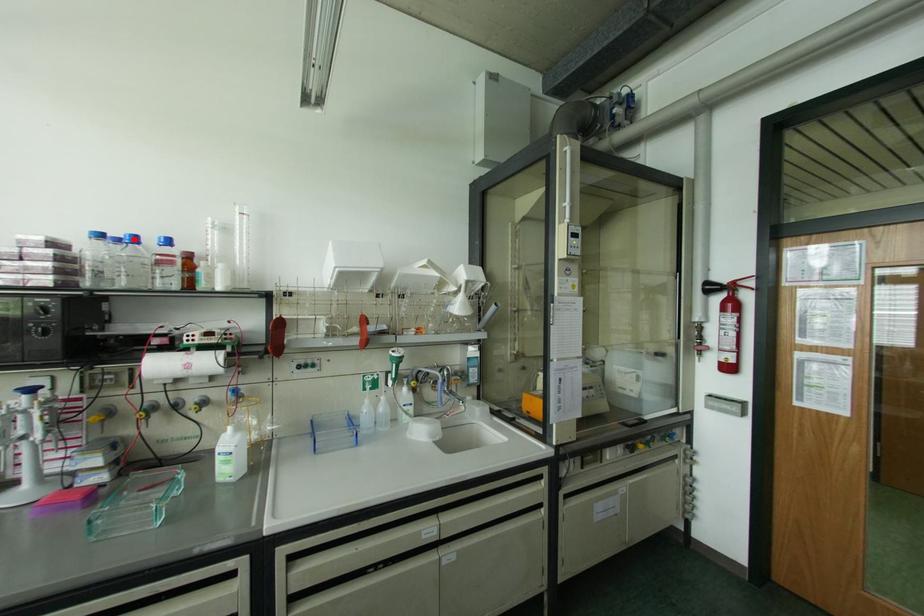
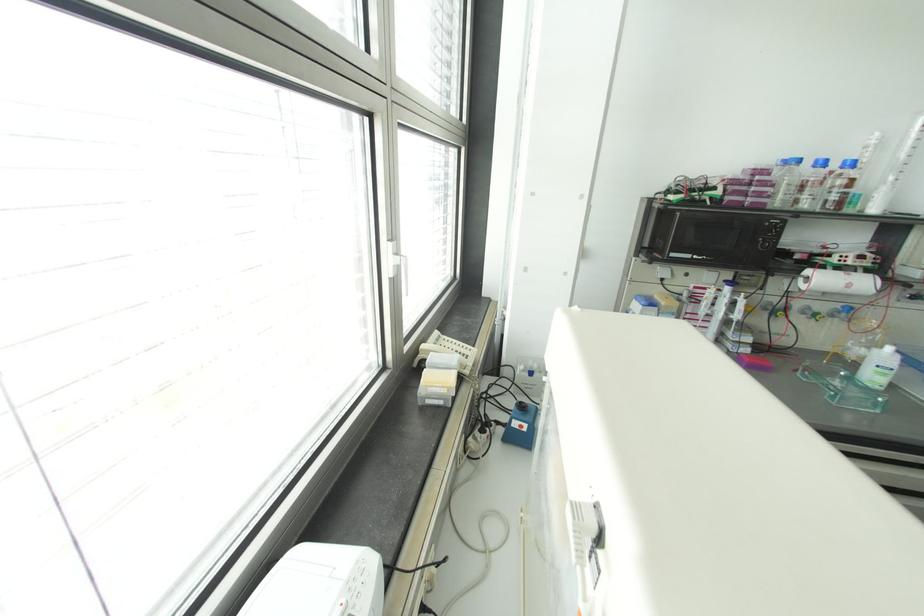
Find the pixel in the second image that matches the highlighted location in the first image.

(822, 163)